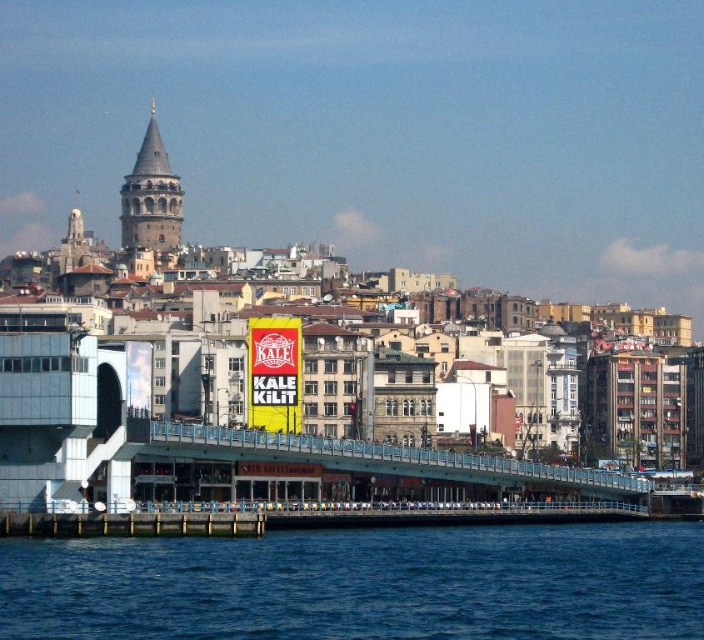
You are a photographer standing at the waterfront and want to capture both the blue water at lower left and the blue metallic bridge at center in your shot. Based on their positions, which one will appear closer to the camera in the final photo?

The blue water at lower left will appear closer to the camera in the final photo because it is positioned in front of the blue metallic bridge at center.